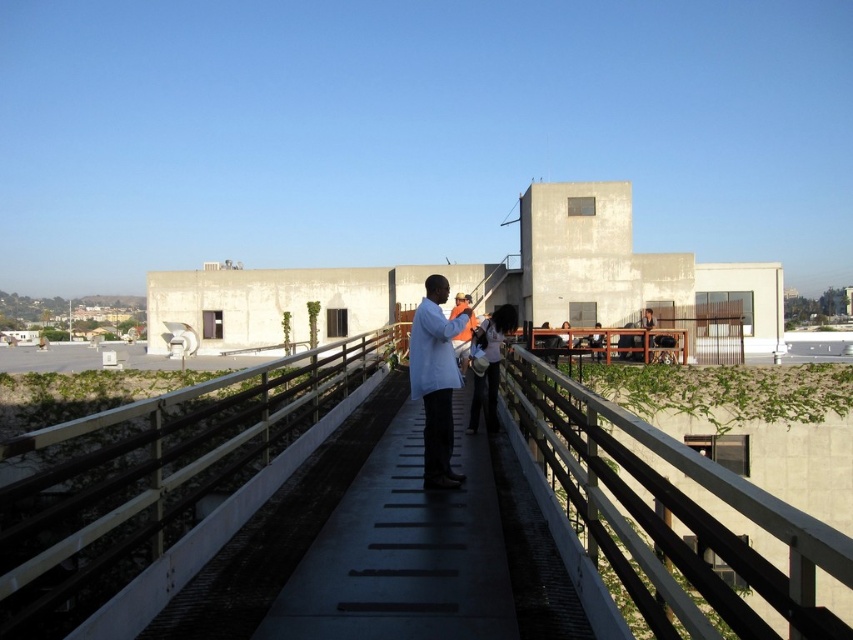
Between metallic gray rail at center and white fabric bag at center, which one appears on the left side from the viewer's perspective?

metallic gray rail at center

Find the location of a particular element. The width and height of the screenshot is (853, 640). metallic gray rail at center is located at coordinates (149, 477).

Where is `metallic gray rail at center`? metallic gray rail at center is located at coordinates (149, 477).

Which is in front, point (108, 577) or point (456, 362)?

Point (456, 362)

Is metallic gray rail at center bigger than white matte coat at center?

Yes.

Between point (68, 432) and point (471, 310), which one is positioned behind?

Positioned behind is point (471, 310).

What are the coordinates of `metallic gray rail at center` in the screenshot? It's located at (149, 477).

Who is more forward, (556,412) or (456,305)?

Positioned in front is point (556,412).

Image resolution: width=853 pixels, height=640 pixels. What do you see at coordinates (672, 518) in the screenshot?
I see `brown wooden rail at center` at bounding box center [672, 518].

Is point (712, 625) closer to camera compared to point (463, 362)?

Yes, it is.

Locate an element on the screen. Image resolution: width=853 pixels, height=640 pixels. brown wooden rail at center is located at coordinates (672, 518).